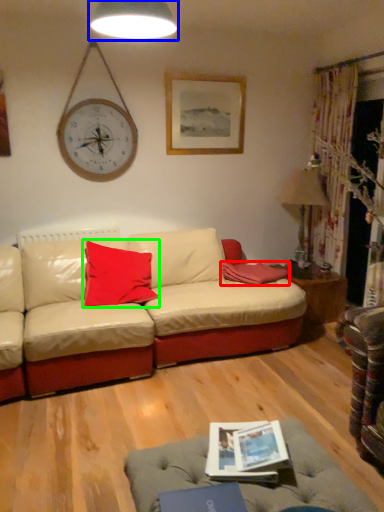
Question: Based on their relative distances, which object is farther from pillow (highlighted by a red box)? Choose from lamp (highlighted by a blue box) and pillow (highlighted by a green box).

Choices:
 (A) lamp
 (B) pillow

Answer: (A)